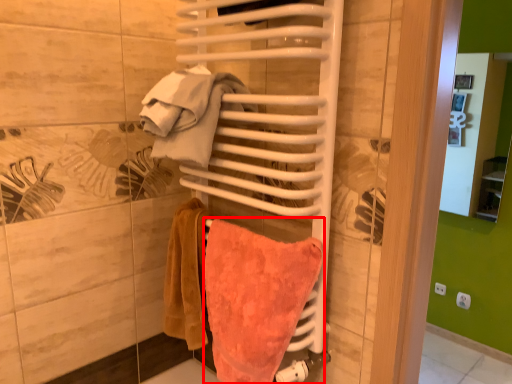
Question: From the image, what is the correct spatial relationship of towel (annotated by the red box) in relation to beach towel?

Choices:
 (A) right
 (B) left

Answer: (A)